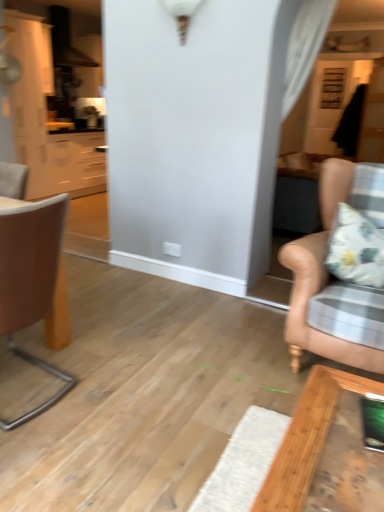
Question: Is matte white cabinets at left bigger than brown leather chair at left, which ranks as the first chair in left-to-right order?

Choices:
 (A) yes
 (B) no

Answer: (A)

Question: Considering the relative positions of matte white cabinets at left and brown leather chair at left, which ranks as the first chair in left-to-right order, in the image provided, is matte white cabinets at left to the right of brown leather chair at left, which ranks as the first chair in left-to-right order, from the viewer's perspective?

Choices:
 (A) no
 (B) yes

Answer: (A)

Question: Is brown leather chair at left, positioned as the 2th chair in right-to-left order, inside matte white cabinets at left?

Choices:
 (A) no
 (B) yes

Answer: (A)

Question: Is matte white cabinets at left positioned beyond the bounds of brown leather chair at left, which ranks as the first chair in left-to-right order?

Choices:
 (A) no
 (B) yes

Answer: (B)

Question: Does matte white cabinets at left have a lesser height compared to brown leather chair at left, which ranks as the first chair in left-to-right order?

Choices:
 (A) yes
 (B) no

Answer: (B)

Question: Looking at their shapes, would you say matte white cabinets at left is wider or thinner than leather couch at right, arranged as the second chair when viewed from the left?

Choices:
 (A) thin
 (B) wide

Answer: (A)

Question: Considering their positions, is matte white cabinets at left located in front of or behind leather couch at right, arranged as the second chair when viewed from the left?

Choices:
 (A) behind
 (B) front

Answer: (A)

Question: In terms of size, does matte white cabinets at left appear bigger or smaller than leather couch at right, arranged as the second chair when viewed from the left?

Choices:
 (A) big
 (B) small

Answer: (A)

Question: Visually, is matte white cabinets at left positioned to the left or to the right of leather couch at right, which is the first chair in right-to-left order?

Choices:
 (A) right
 (B) left

Answer: (B)

Question: Considering the positions of leather couch at right, arranged as the second chair when viewed from the left, and brown leather chair at left, which ranks as the first chair in left-to-right order, in the image, is leather couch at right, arranged as the second chair when viewed from the left, wider or thinner than brown leather chair at left, which ranks as the first chair in left-to-right order,?

Choices:
 (A) wide
 (B) thin

Answer: (A)

Question: Is leather couch at right, which is the first chair in right-to-left order, situated inside brown leather chair at left, positioned as the 2th chair in right-to-left order, or outside?

Choices:
 (A) outside
 (B) inside

Answer: (A)

Question: Is point (331, 214) positioned closer to the camera than point (56, 394)?

Choices:
 (A) closer
 (B) farther

Answer: (B)

Question: Considering their positions, is leather couch at right, arranged as the second chair when viewed from the left, located in front of or behind brown leather chair at left, which ranks as the first chair in left-to-right order?

Choices:
 (A) front
 (B) behind

Answer: (B)

Question: Is matte white cabinets at left wider or thinner than brown leather chair at left, positioned as the 2th chair in right-to-left order?

Choices:
 (A) thin
 (B) wide

Answer: (B)

Question: Considering the positions of matte white cabinets at left and brown leather chair at left, positioned as the 2th chair in right-to-left order, in the image, is matte white cabinets at left bigger or smaller than brown leather chair at left, positioned as the 2th chair in right-to-left order,?

Choices:
 (A) big
 (B) small

Answer: (A)